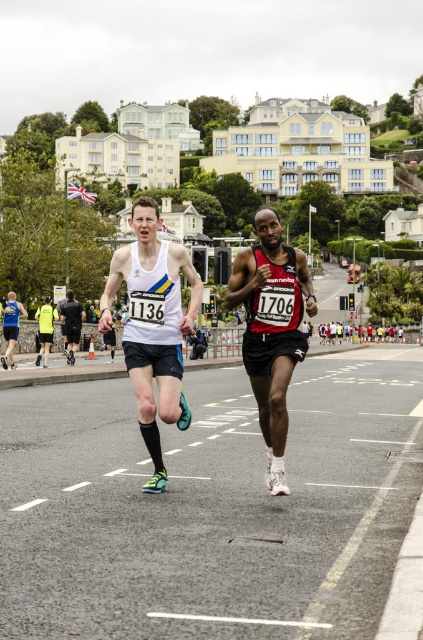
Question: Which point appears closest to the camera in this image?

Choices:
 (A) (258, 307)
 (B) (74, 307)
 (C) (172, 284)

Answer: (A)

Question: Is black matte running shoe at center to the left of black matte shorts at center from the viewer's perspective?

Choices:
 (A) yes
 (B) no

Answer: (B)

Question: Observing the image, what is the correct spatial positioning of white matte tank top at center in reference to black matte running shoe at center?

Choices:
 (A) right
 (B) left

Answer: (B)

Question: Is white matte tank top at center positioned behind black matte running shoe at center?

Choices:
 (A) yes
 (B) no

Answer: (B)

Question: Which point is farther to the camera?

Choices:
 (A) (126, 259)
 (B) (79, 323)

Answer: (B)

Question: Among these objects, which one is nearest to the camera?

Choices:
 (A) black matte running shoe at center
 (B) black matte shorts at center

Answer: (A)